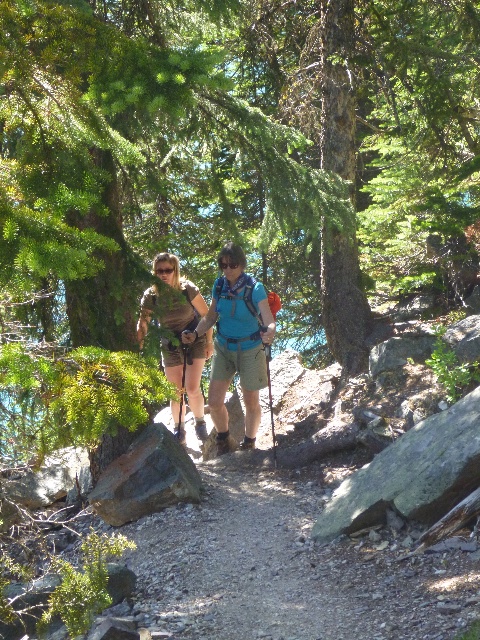
Can you confirm if green leafy tree at center is positioned to the right of blue fabric backpack at center?

In fact, green leafy tree at center is to the left of blue fabric backpack at center.

Which is more to the left, green leafy tree at center or blue fabric backpack at center?

green leafy tree at center

Between point (144, 80) and point (222, 387), which one is positioned behind?

Point (222, 387)

Where is `green leafy tree at center`? This screenshot has width=480, height=640. green leafy tree at center is located at coordinates (157, 152).

Can you confirm if blue fabric backpack at center is smaller than matte brown shorts at center?

Yes, blue fabric backpack at center is smaller than matte brown shorts at center.

Does blue fabric backpack at center appear under matte brown shorts at center?

Incorrect, blue fabric backpack at center is not positioned below matte brown shorts at center.

This screenshot has width=480, height=640. Describe the element at coordinates (236, 344) in the screenshot. I see `blue fabric backpack at center` at that location.

At what (x,y) coordinates should I click in order to perform the action: click on blue fabric backpack at center. Please return your answer as a coordinate pair (x, y). This screenshot has height=640, width=480. Looking at the image, I should click on (236, 344).

Which of these two, green leafy tree at center or matte brown shorts at center, stands shorter?

Standing shorter between the two is matte brown shorts at center.

Is green leafy tree at center above matte brown shorts at center?

Yes, green leafy tree at center is above matte brown shorts at center.

Describe the element at coordinates (157, 152) in the screenshot. I see `green leafy tree at center` at that location.

You are a GUI agent. You are given a task and a screenshot of the screen. Output one action in this format:
    pyautogui.click(x=<x>, y=<y>)
    Task: Click on the green leafy tree at center
    
    Given the screenshot: What is the action you would take?
    pyautogui.click(x=157, y=152)